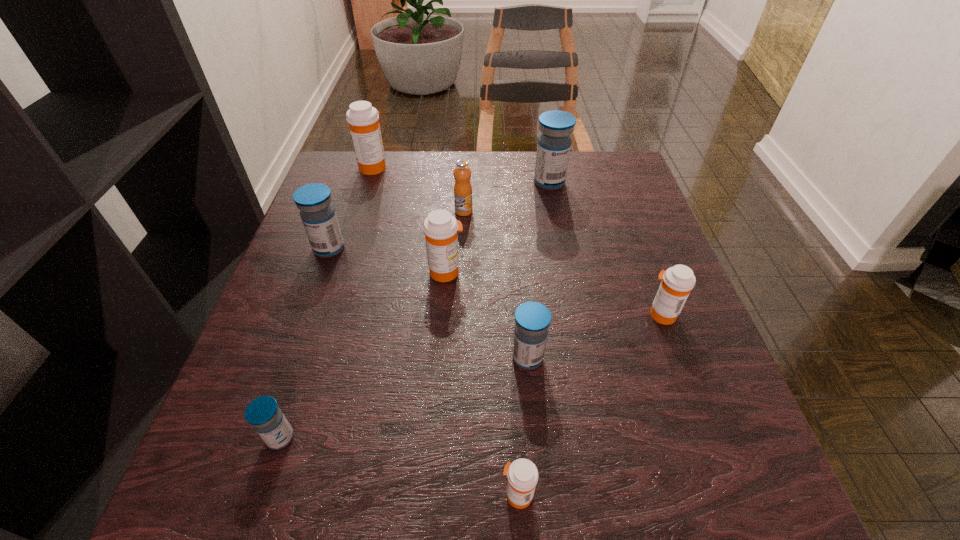
The height and width of the screenshot is (540, 960). Find the location of `the sixth farthest medicine`. the sixth farthest medicine is located at coordinates (532, 319).

Where is `the fifth farthest medicine`? The height and width of the screenshot is (540, 960). the fifth farthest medicine is located at coordinates (677, 282).

You are a GUI agent. You are given a task and a screenshot of the screen. Output one action in this format:
    pyautogui.click(x=<x>, y=<y>)
    Task: Click on the sixth farthest object
    The height and width of the screenshot is (540, 960).
    Given the screenshot: What is the action you would take?
    pyautogui.click(x=677, y=282)

Identify the location of the smallest blue medicine. (267, 419).

Locate an element on the screen. This screenshot has width=960, height=540. the second nearest medicine is located at coordinates (267, 419).

I want to click on the nearest orange medicine, so click(522, 474).

Identify the location of the nearest medicine. Image resolution: width=960 pixels, height=540 pixels. (522, 474).

Locate an element on the screen. This screenshot has width=960, height=540. free space located on the front of the second medicine from right to left is located at coordinates (559, 229).

The width and height of the screenshot is (960, 540). I want to click on free spot located on the front of the farthest orange medicine, so click(x=348, y=247).

The width and height of the screenshot is (960, 540). I want to click on free spot located 0.170m on the right of the fifth farthest object, so click(543, 272).